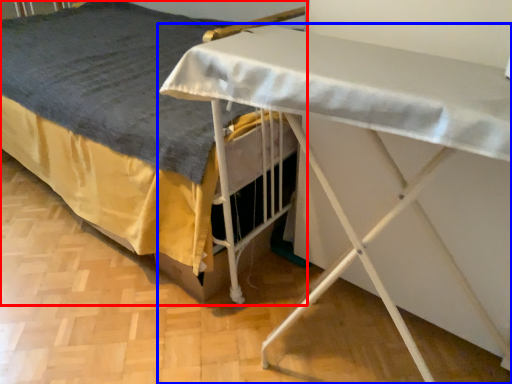
Question: Which point is further to the camera, bed (highlighted by a red box) or table (highlighted by a blue box)?

Choices:
 (A) bed
 (B) table

Answer: (A)